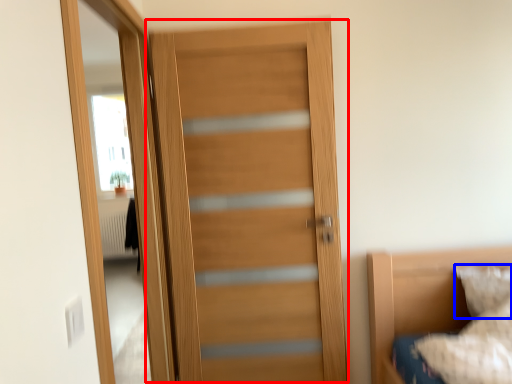
Question: Which of the following is the closest to the observer, door (highlighted by a red box) or pillow (highlighted by a blue box)?

Choices:
 (A) door
 (B) pillow

Answer: (A)